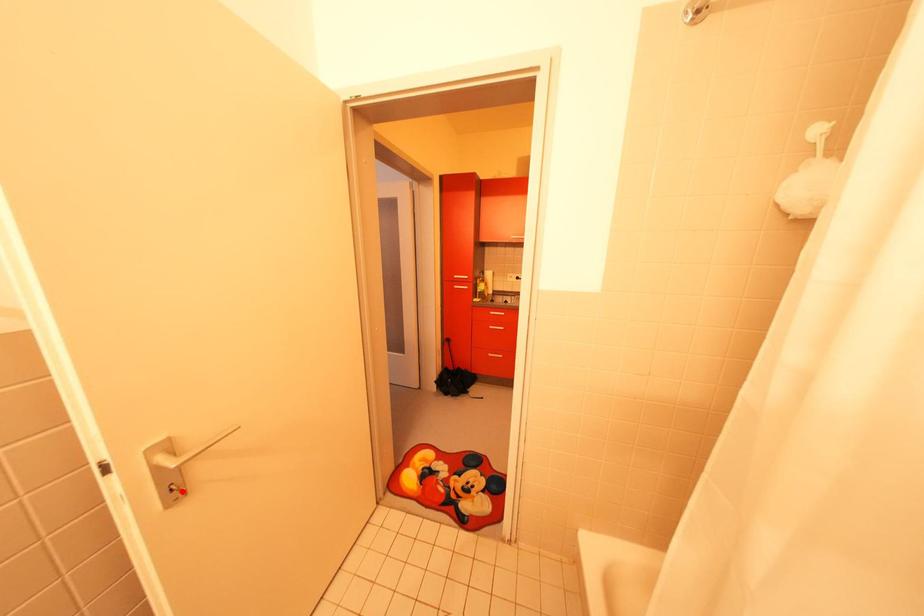
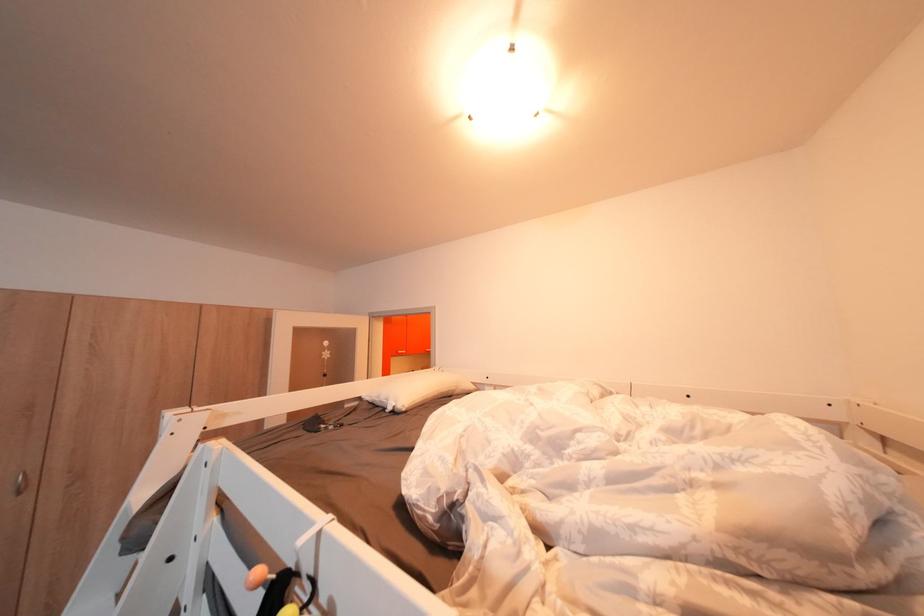
Question: I am providing you with two images of the same scene from different viewpoints. A red point is marked on the first image. Is the red point's position out of view in image 2?

Choices:
 (A) Yes
 (B) No

Answer: (A)